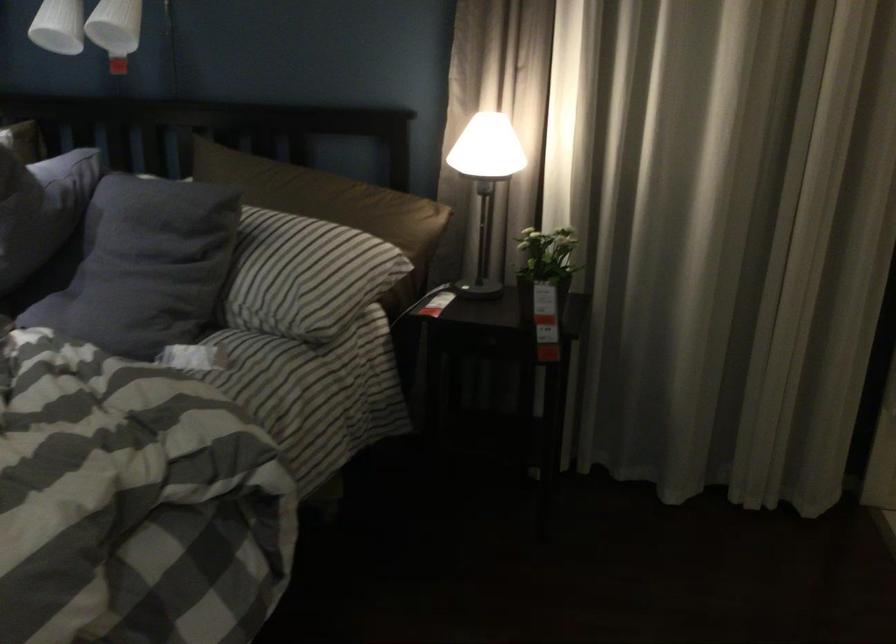
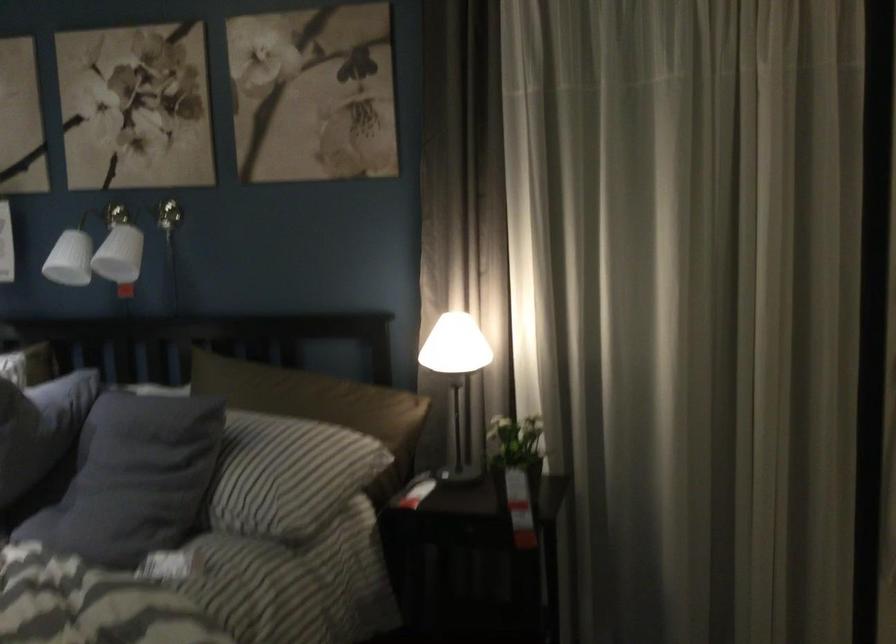
In a continuous first-person perspective shot, in which direction is the camera moving?

The movement direction of the cameraman is right, backward.